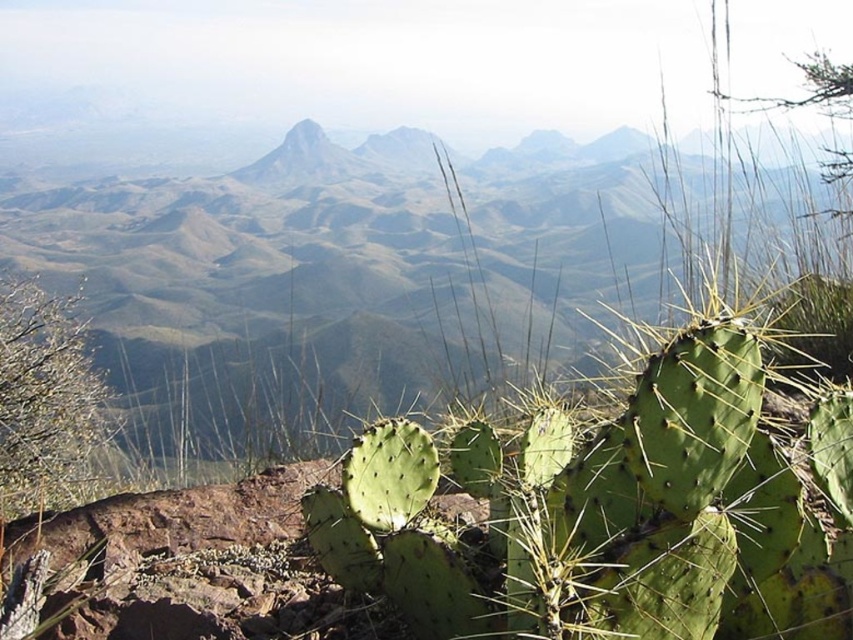
Can you confirm if green textured mountain range at center is wider than green spiny cactus at center?

Yes, green textured mountain range at center is wider than green spiny cactus at center.

Can you confirm if green textured mountain range at center is positioned to the left of green spiny cactus at center?

Correct, you'll find green textured mountain range at center to the left of green spiny cactus at center.

Between point (202, 248) and point (701, 536), which one is positioned in front?

Point (701, 536) is more forward.

The width and height of the screenshot is (853, 640). Identify the location of green textured mountain range at center. (352, 275).

Does green textured mountain range at center have a larger size compared to green spiny cactus at lower left?

Indeed, green textured mountain range at center has a larger size compared to green spiny cactus at lower left.

Find the location of `green textured mountain range at center`. green textured mountain range at center is located at coordinates (352, 275).

Image resolution: width=853 pixels, height=640 pixels. Describe the element at coordinates (352, 275) in the screenshot. I see `green textured mountain range at center` at that location.

The width and height of the screenshot is (853, 640). Find the location of `green textured mountain range at center`. green textured mountain range at center is located at coordinates (352, 275).

Based on the photo, who is positioned more to the left, green spiny cactus at center or green spiny cactus at lower left?

green spiny cactus at lower left is more to the left.

This screenshot has width=853, height=640. I want to click on green spiny cactus at center, so click(x=614, y=508).